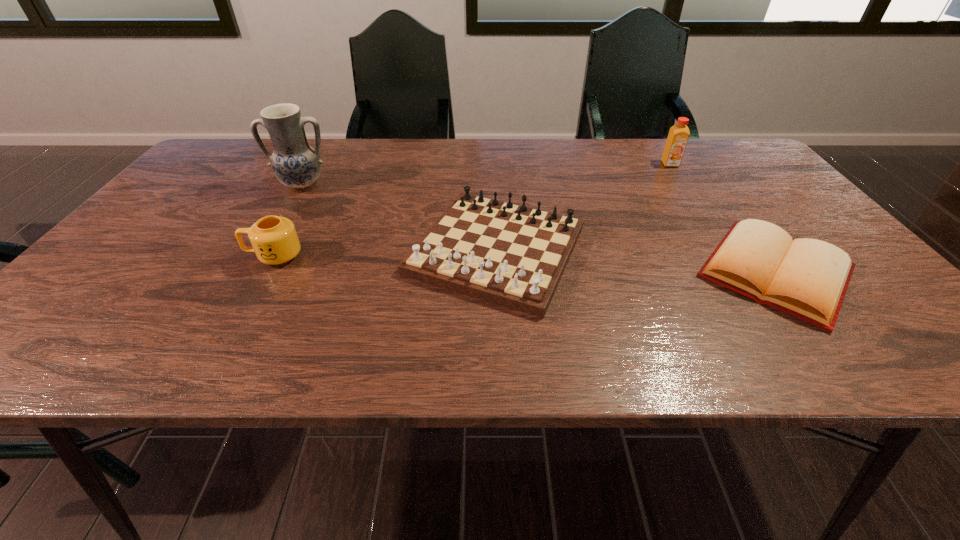
The image size is (960, 540). Identify the location of vacant space situated on the handle side of the mug. (214, 256).

At what (x,y) coordinates should I click in order to perform the action: click on vacant point located 0.060m on the handle side of the mug. Please return your answer as a coordinate pair (x, y). The height and width of the screenshot is (540, 960). Looking at the image, I should click on (219, 256).

You are a GUI agent. You are given a task and a screenshot of the screen. Output one action in this format:
    pyautogui.click(x=<x>, y=<y>)
    Task: Click on the vacant region located on the handle side of the mug
    The image size is (960, 540).
    Given the screenshot: What is the action you would take?
    pyautogui.click(x=201, y=256)

Locate an element on the screen. The width and height of the screenshot is (960, 540). free space located on the left of the third object from right to left is located at coordinates (339, 251).

At what (x,y) coordinates should I click in order to perform the action: click on vacant space situated 0.350m on the left of the shortest object. Please return your answer as a coordinate pair (x, y). Looking at the image, I should click on (532, 272).

The image size is (960, 540). Identify the location of pottery positioned at the far edge. (295, 163).

Locate an element on the screen. Image resolution: width=960 pixels, height=540 pixels. orange juice that is at the far edge is located at coordinates (678, 136).

Locate an element on the screen. object that is at the near edge is located at coordinates click(806, 278).

In order to click on object that is at the right edge in this screenshot , I will do `click(806, 278)`.

This screenshot has height=540, width=960. What are the coordinates of `object located in the near right corner section of the desktop` in the screenshot? It's located at (806, 278).